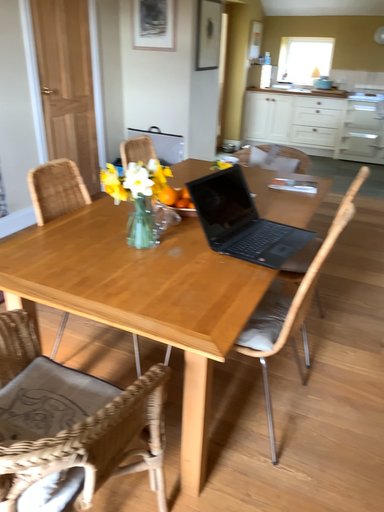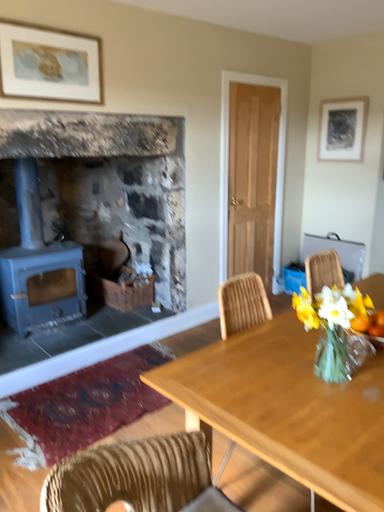
Question: How did the camera likely rotate when shooting the video?

Choices:
 (A) rotated downward
 (B) rotated upward

Answer: (B)